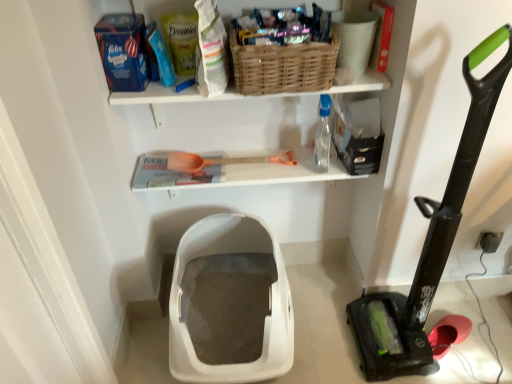
Question: Does woven brown basket at upper center have a greater width compared to black rubber vacuum at right?

Choices:
 (A) yes
 (B) no

Answer: (B)

Question: From the image's perspective, is woven brown basket at upper center on top of black rubber vacuum at right?

Choices:
 (A) yes
 (B) no

Answer: (A)

Question: Could you tell me if woven brown basket at upper center is turned towards black rubber vacuum at right?

Choices:
 (A) yes
 (B) no

Answer: (B)

Question: Is woven brown basket at upper center in front of black rubber vacuum at right?

Choices:
 (A) no
 (B) yes

Answer: (A)

Question: Is black rubber vacuum at right a part of woven brown basket at upper center?

Choices:
 (A) no
 (B) yes

Answer: (A)

Question: Considering the relative positions of white plastic litter box at center, positioned as the first storage box in left-to-right order, and woven brown basket at upper center in the image provided, is white plastic litter box at center, positioned as the first storage box in left-to-right order, to the left or to the right of woven brown basket at upper center?

Choices:
 (A) right
 (B) left

Answer: (B)

Question: Considering the positions of white plastic litter box at center, which is the second storage box in right-to-left order, and woven brown basket at upper center in the image, is white plastic litter box at center, which is the second storage box in right-to-left order, taller or shorter than woven brown basket at upper center?

Choices:
 (A) short
 (B) tall

Answer: (B)

Question: Is point (210, 291) closer or farther from the camera than point (314, 82)?

Choices:
 (A) farther
 (B) closer

Answer: (A)

Question: From a real-world perspective, is white plastic litter box at center, which is the first storage box from bottom to top, physically located above or below woven brown basket at upper center?

Choices:
 (A) above
 (B) below

Answer: (B)

Question: Considering the positions of white plastic litter box at center, which is the first storage box from bottom to top, and black matte storage box at upper right, marked as the 1th storage box in a top-to-bottom arrangement, in the image, is white plastic litter box at center, which is the first storage box from bottom to top, bigger or smaller than black matte storage box at upper right, marked as the 1th storage box in a top-to-bottom arrangement,?

Choices:
 (A) big
 (B) small

Answer: (A)

Question: From their relative heights in the image, would you say white plastic litter box at center, placed as the second storage box when sorted from top to bottom, is taller or shorter than black matte storage box at upper right, which ranks as the second storage box in bottom-to-top order?

Choices:
 (A) tall
 (B) short

Answer: (A)

Question: From a real-world perspective, is white plastic litter box at center, which is the first storage box from bottom to top, positioned above or below black matte storage box at upper right, the first storage box in the right-to-left sequence?

Choices:
 (A) above
 (B) below

Answer: (B)

Question: Is white plastic litter box at center, placed as the second storage box when sorted from top to bottom, wider or thinner than black matte storage box at upper right, which ranks as the second storage box in bottom-to-top order?

Choices:
 (A) thin
 (B) wide

Answer: (B)

Question: Is transparent plastic bottle at upper right taller or shorter than orange plastic shovel at center?

Choices:
 (A) short
 (B) tall

Answer: (B)

Question: Is transparent plastic bottle at upper right situated inside orange plastic shovel at center or outside?

Choices:
 (A) outside
 (B) inside

Answer: (A)